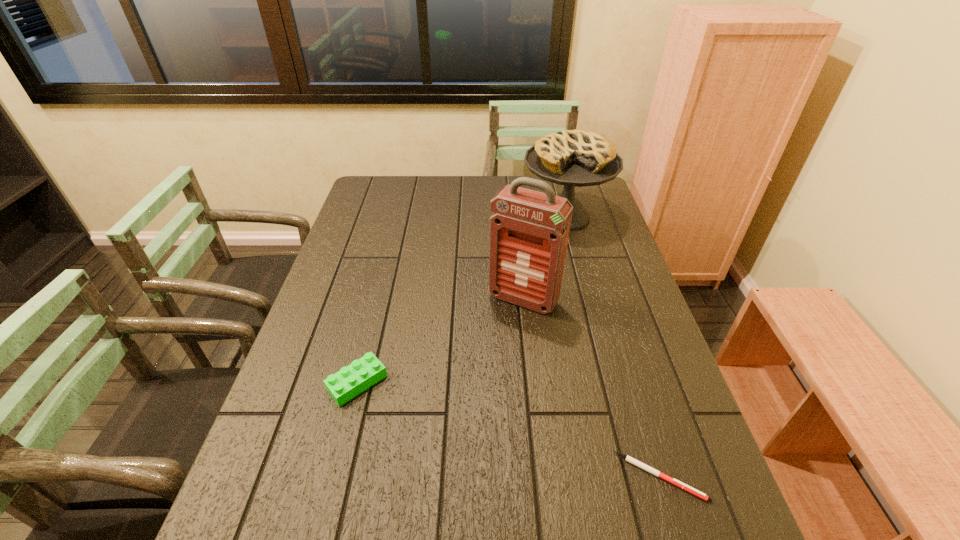
Find the location of a particular element. object at the far right corner is located at coordinates (579, 158).

Locate an element on the screen. This screenshot has height=540, width=960. object located at the near right corner is located at coordinates (637, 463).

What are the coordinates of `vacant space at the far edge` in the screenshot? It's located at (478, 208).

You are a GUI agent. You are given a task and a screenshot of the screen. Output one action in this format:
    pyautogui.click(x=<x>, y=<y>)
    Task: Click on the free region at the near edge
    
    Given the screenshot: What is the action you would take?
    pyautogui.click(x=446, y=472)

Locate an element on the screen. Image resolution: width=960 pixels, height=540 pixels. vacant space at the left edge of the desktop is located at coordinates (390, 225).

Identify the location of vacant space at the right edge of the desktop. Image resolution: width=960 pixels, height=540 pixels. (667, 459).

Locate an element on the screen. The width and height of the screenshot is (960, 540). free space at the near right corner of the desktop is located at coordinates (715, 503).

You are a GUI agent. You are given a task and a screenshot of the screen. Output one action in this format:
    pyautogui.click(x=<x>, y=<y>)
    Task: Click on the free area in between the farthest object and the pen
    
    Given the screenshot: What is the action you would take?
    pyautogui.click(x=612, y=347)

The image size is (960, 540). What are the coordinates of `empty space between the first-aid kit and the nearest object` in the screenshot? It's located at (591, 388).

I want to click on vacant area between the nearest object and the third shortest object, so point(612,347).